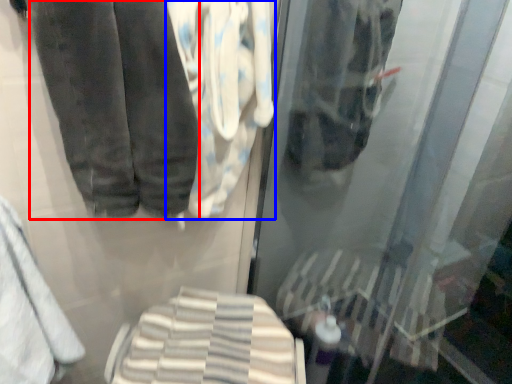
Question: Which object is further to the camera taking this photo, trousers (highlighted by a red box) or cloth (highlighted by a blue box)?

Choices:
 (A) trousers
 (B) cloth

Answer: (B)